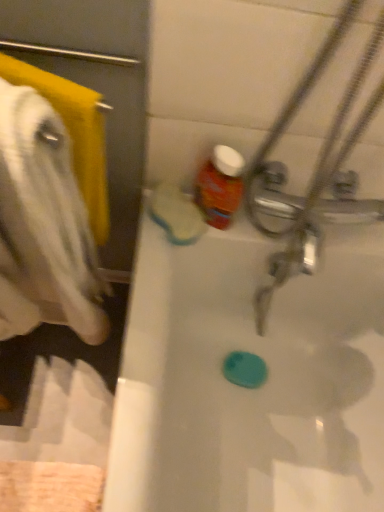
Question: Is matte plastic bottle at upper center further to the viewer compared to white soft towel at left?

Choices:
 (A) no
 (B) yes

Answer: (B)

Question: Is matte plastic bottle at upper center aimed at white soft towel at left?

Choices:
 (A) no
 (B) yes

Answer: (A)

Question: From a real-world perspective, is matte plastic bottle at upper center beneath white soft towel at left?

Choices:
 (A) yes
 (B) no

Answer: (A)

Question: From a real-world perspective, is matte plastic bottle at upper center located higher than white soft towel at left?

Choices:
 (A) no
 (B) yes

Answer: (A)

Question: From the image's perspective, is matte plastic bottle at upper center on white soft towel at left?

Choices:
 (A) yes
 (B) no

Answer: (B)

Question: Based on their positions, is white glossy bathtub at center located to the left or right of matte plastic bottle at upper center?

Choices:
 (A) right
 (B) left

Answer: (A)

Question: Is white glossy bathtub at center bigger or smaller than matte plastic bottle at upper center?

Choices:
 (A) big
 (B) small

Answer: (A)

Question: Would you say white glossy bathtub at center is inside or outside matte plastic bottle at upper center?

Choices:
 (A) inside
 (B) outside

Answer: (B)

Question: From a real-world perspective, is white glossy bathtub at center positioned above or below matte plastic bottle at upper center?

Choices:
 (A) above
 (B) below

Answer: (B)

Question: Is matte plastic bottle at upper center bigger or smaller than white glossy bathtub at center?

Choices:
 (A) big
 (B) small

Answer: (B)

Question: Is matte plastic bottle at upper center situated inside white glossy bathtub at center or outside?

Choices:
 (A) outside
 (B) inside

Answer: (A)

Question: Does point (216, 156) appear closer or farther from the camera than point (223, 453)?

Choices:
 (A) closer
 (B) farther

Answer: (A)

Question: In the image, is matte plastic bottle at upper center positioned in front of or behind white glossy bathtub at center?

Choices:
 (A) front
 (B) behind

Answer: (B)

Question: In terms of width, does white glossy bathtub at center look wider or thinner when compared to white soft towel at left?

Choices:
 (A) wide
 (B) thin

Answer: (A)

Question: Would you say white glossy bathtub at center is inside or outside white soft towel at left?

Choices:
 (A) outside
 (B) inside

Answer: (A)